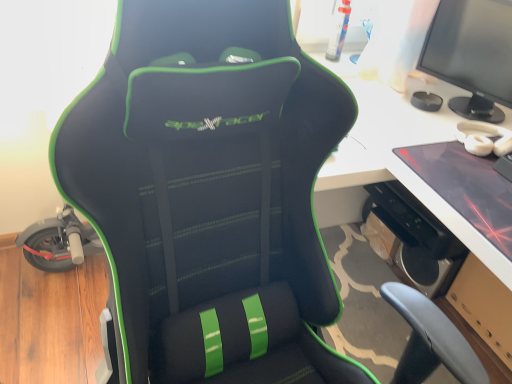
Question: Does matte black laptop at right have a greater width compared to matte black monitor at upper right?

Choices:
 (A) no
 (B) yes

Answer: (B)

Question: Considering the relative sizes of matte black laptop at right and matte black monitor at upper right in the image provided, is matte black laptop at right smaller than matte black monitor at upper right?

Choices:
 (A) yes
 (B) no

Answer: (A)

Question: Considering the relative positions of matte black laptop at right and matte black monitor at upper right in the image provided, is matte black laptop at right in front of matte black monitor at upper right?

Choices:
 (A) yes
 (B) no

Answer: (A)

Question: Would you say matte black laptop at right contains matte black monitor at upper right?

Choices:
 (A) yes
 (B) no

Answer: (B)

Question: From a real-world perspective, is matte black laptop at right on matte black monitor at upper right?

Choices:
 (A) no
 (B) yes

Answer: (A)

Question: Can you confirm if matte black laptop at right is bigger than matte black monitor at upper right?

Choices:
 (A) no
 (B) yes

Answer: (A)

Question: Does matte black monitor at upper right appear on the left side of black matte speaker at lower right?

Choices:
 (A) no
 (B) yes

Answer: (A)

Question: Is matte black monitor at upper right to the right of black matte speaker at lower right from the viewer's perspective?

Choices:
 (A) no
 (B) yes

Answer: (B)

Question: Is matte black monitor at upper right wider than black matte speaker at lower right?

Choices:
 (A) yes
 (B) no

Answer: (A)

Question: Can black matte speaker at lower right be found inside matte black monitor at upper right?

Choices:
 (A) no
 (B) yes

Answer: (A)

Question: Would you say matte black monitor at upper right is outside black matte speaker at lower right?

Choices:
 (A) no
 (B) yes

Answer: (B)

Question: Is matte black monitor at upper right facing towards black matte speaker at lower right?

Choices:
 (A) yes
 (B) no

Answer: (B)

Question: Considering the relative positions of black matte speaker at lower right and matte black monitor at upper right in the image provided, is black matte speaker at lower right to the left of matte black monitor at upper right from the viewer's perspective?

Choices:
 (A) no
 (B) yes

Answer: (B)